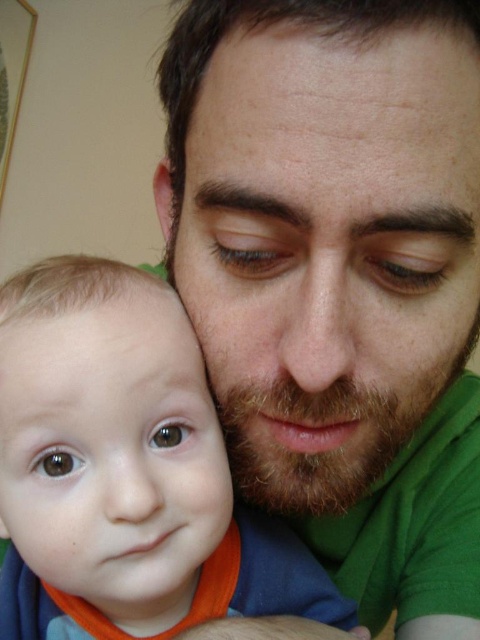
Which is below, green matte shirt at center or smooth skin forehead at upper center?

Positioned lower is green matte shirt at center.

Does green matte shirt at center have a smaller size compared to smooth skin forehead at upper center?

No.

Is point (428, 67) behind point (207, 6)?

No.

At what (x,y) coordinates should I click in order to perform the action: click on green matte shirt at center. Please return your answer as a coordinate pair (x, y). Looking at the image, I should click on (338, 278).

Is point (176, 611) farther from camera compared to point (224, 28)?

Yes, it is behind point (224, 28).

Is smooth orange bib at lower left behind smooth skin forehead at upper center?

Yes, it is behind smooth skin forehead at upper center.

You are a GUI agent. You are given a task and a screenshot of the screen. Output one action in this format:
    pyautogui.click(x=<x>, y=<y>)
    Task: Click on the smooth orange bib at lower left
    
    Given the screenshot: What is the action you would take?
    pyautogui.click(x=124, y=467)

Can you confirm if green matte shirt at center is shorter than smooth orange bib at lower left?

In fact, green matte shirt at center may be taller than smooth orange bib at lower left.

Is green matte shirt at center positioned behind smooth orange bib at lower left?

No, green matte shirt at center is closer to the viewer.

This screenshot has width=480, height=640. I want to click on green matte shirt at center, so point(338,278).

Identify the location of green matte shirt at center. (338, 278).